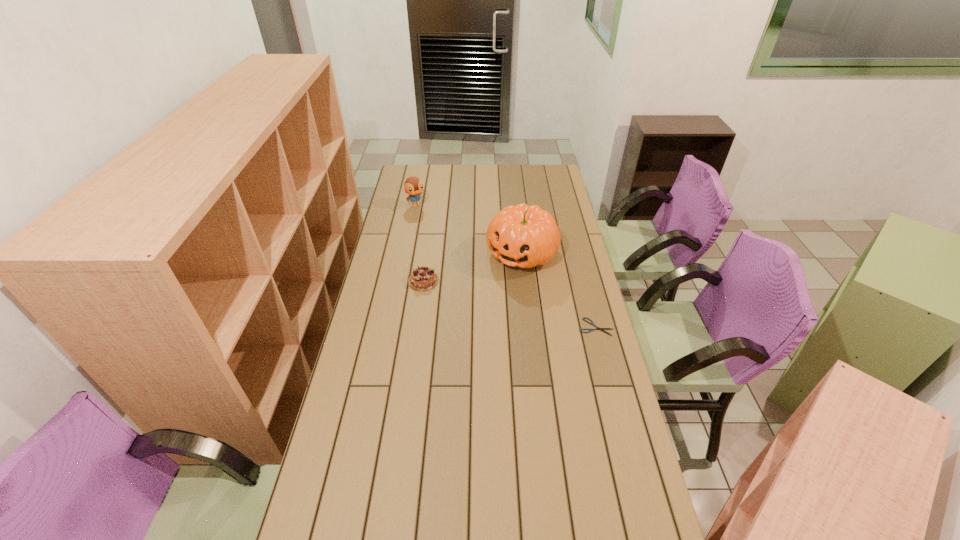
This screenshot has height=540, width=960. Find the location of `free area in between the second shortest object and the third object from left to right`. free area in between the second shortest object and the third object from left to right is located at coordinates (472, 267).

This screenshot has height=540, width=960. I want to click on unoccupied position between the chocolate cake and the shears, so click(x=510, y=304).

Where is `free point between the chocolate cake and the third shortest object`? free point between the chocolate cake and the third shortest object is located at coordinates (420, 243).

This screenshot has width=960, height=540. I want to click on empty location between the second object from right to left and the nearest object, so click(x=559, y=290).

The height and width of the screenshot is (540, 960). I want to click on free space between the pumpkin and the third tallest object, so click(x=472, y=267).

The height and width of the screenshot is (540, 960). What are the coordinates of `object that is the closest one to the farthest object` in the screenshot? It's located at (525, 236).

Where is `the second closest object to the chocolate cake`? This screenshot has height=540, width=960. the second closest object to the chocolate cake is located at coordinates (413, 186).

You are a GUI agent. You are given a task and a screenshot of the screen. Output one action in this format:
    pyautogui.click(x=<x>, y=<y>)
    Task: Click on the vacant point that satisfies the following two spatial constraints: 1. on the front side of the tallest object; 2. on the right side of the farthest object
    This screenshot has height=540, width=960.
    Given the screenshot: What is the action you would take?
    pyautogui.click(x=406, y=253)

Locate an element on the screen. The width and height of the screenshot is (960, 540). blank space that satisfies the following two spatial constraints: 1. on the front side of the shears; 2. on the right side of the third tallest object is located at coordinates [417, 327].

Identify the location of vacant space that satisfies the following two spatial constraints: 1. on the front side of the second tallest object; 2. on the right side of the second shortest object. The image size is (960, 540). (400, 281).